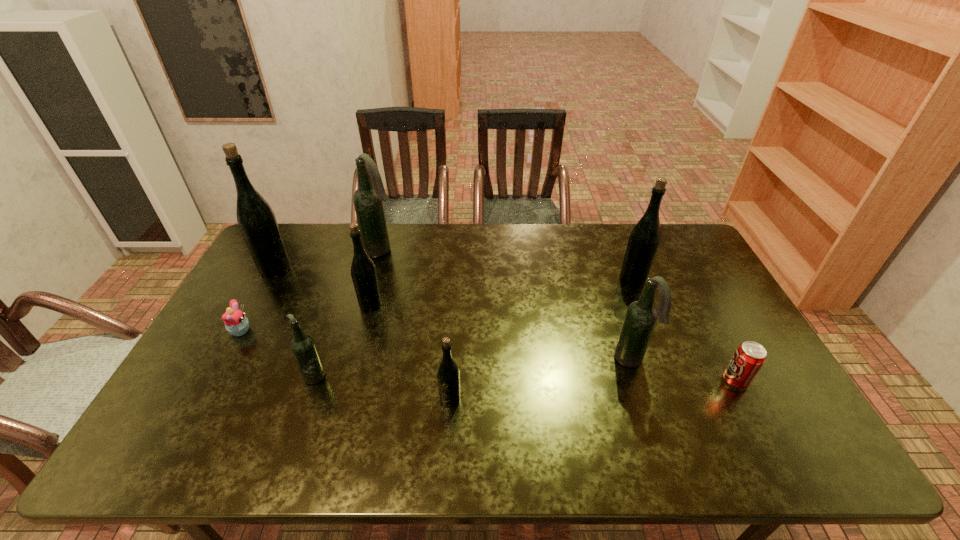
Find the location of `vacant space located on the front of the second smallest dark beer bottle`. vacant space located on the front of the second smallest dark beer bottle is located at coordinates (642, 395).

Find the location of a particular element. free space located 0.110m on the right of the smallest dark beer bottle is located at coordinates (368, 375).

Identify the location of vacant space located 0.130m on the back of the third green beer bottle from left to right. The height and width of the screenshot is (540, 960). (453, 350).

This screenshot has height=540, width=960. Identify the location of vacant space located 0.060m on the left of the eighth tallest object. (700, 381).

Image resolution: width=960 pixels, height=540 pixels. I want to click on free spot located 0.360m on the face of the fifth farthest object, so click(x=373, y=331).

You are a GUI agent. You are given a task and a screenshot of the screen. Output one action in this format:
    pyautogui.click(x=<x>, y=<y>)
    Task: Click on the beer bottle present at the left edge
    The height and width of the screenshot is (540, 960).
    Given the screenshot: What is the action you would take?
    pyautogui.click(x=256, y=220)

Where is `cupcake positioned at the left edge`? The height and width of the screenshot is (540, 960). cupcake positioned at the left edge is located at coordinates click(236, 323).

In order to click on object that is at the right edge in this screenshot , I will do `click(748, 359)`.

Identify the location of object positioned at the far left corner. (256, 220).

At what (x,y) coordinates should I click in order to perform the action: click on vacant space at the far edge of the desktop. Please return your answer as a coordinate pair (x, y). This screenshot has width=960, height=540. Looking at the image, I should click on (483, 239).